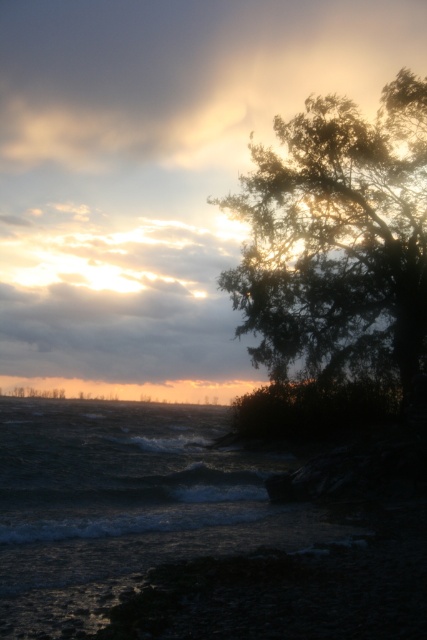
Does dark gray water at lower left appear under silhouette leafy tree at upper right?

Yes.

The image size is (427, 640). What do you see at coordinates (125, 504) in the screenshot?
I see `dark gray water at lower left` at bounding box center [125, 504].

Identify the location of dark gray water at lower left. The height and width of the screenshot is (640, 427). (125, 504).